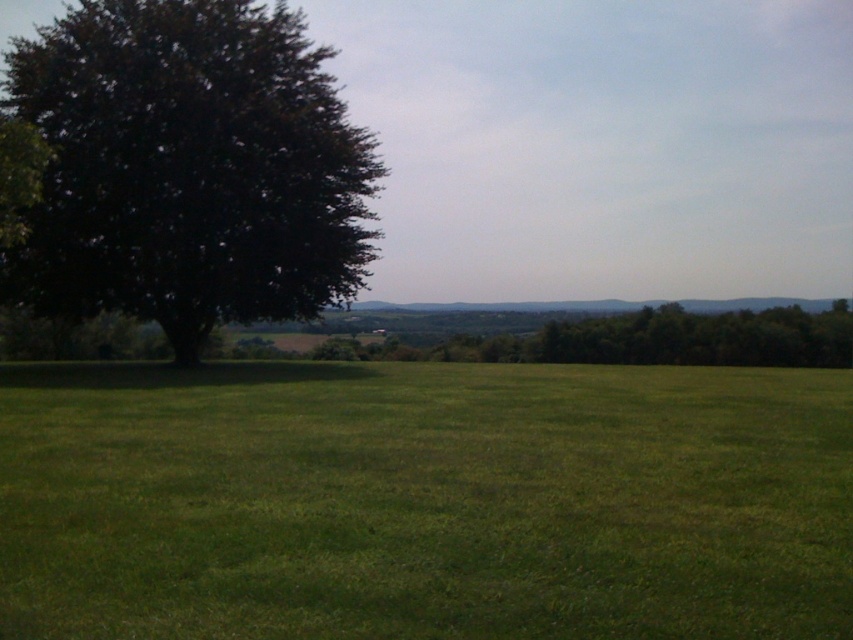
Question: Is green grass at center above dark green leafy tree at left?

Choices:
 (A) yes
 (B) no

Answer: (B)

Question: Is green grass at center to the right of dark green leafy tree at left from the viewer's perspective?

Choices:
 (A) no
 (B) yes

Answer: (B)

Question: Which of the following is the closest to the observer?

Choices:
 (A) dark green leafy tree at left
 (B) green grass at center

Answer: (B)

Question: In this image, where is green grass at center located relative to dark green leafy tree at left?

Choices:
 (A) below
 (B) above

Answer: (A)

Question: Which point is closer to the camera?

Choices:
 (A) dark green leafy tree at left
 (B) green grass at center

Answer: (B)

Question: Which point is closer to the camera?

Choices:
 (A) (364, 192)
 (B) (299, 401)

Answer: (B)